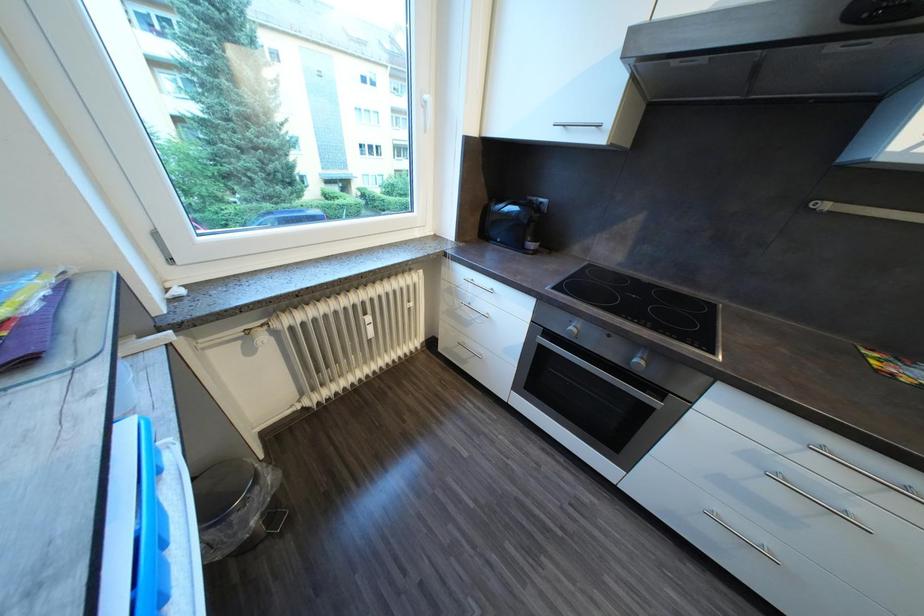
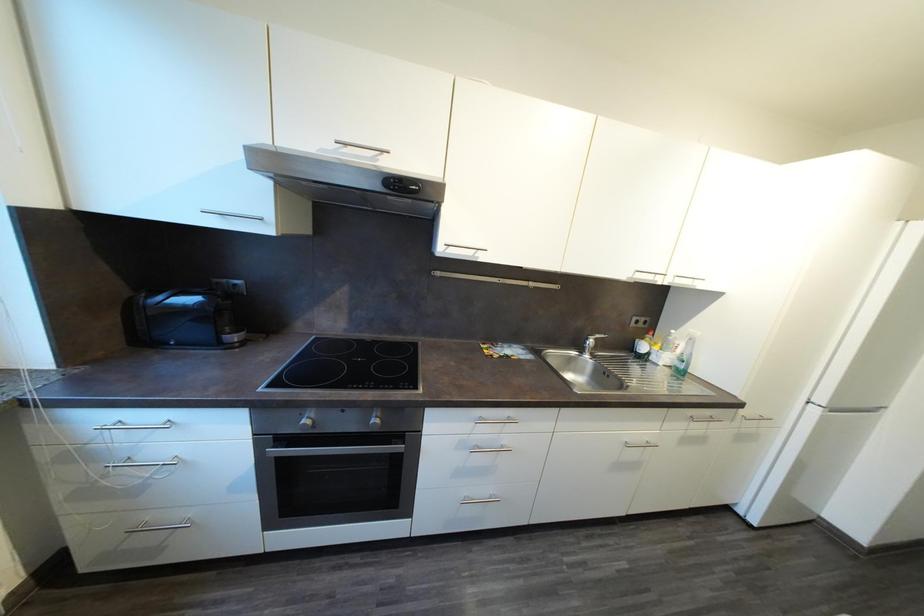
Question: The images are taken continuously from a first-person perspective. In which direction is your viewpoint rotating?

Choices:
 (A) Left
 (B) Right
 (C) Up
 (D) Down

Answer: (B)